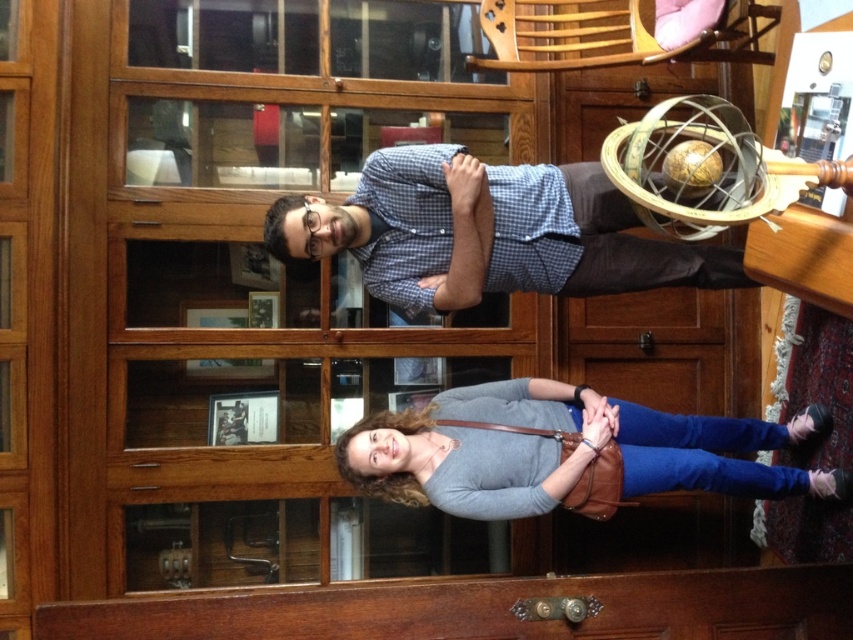
Question: Is transparent wood glass door at upper center closer to the viewer compared to matte gray sweater at lower center?

Choices:
 (A) no
 (B) yes

Answer: (A)

Question: Which of the following is the closest to the observer?

Choices:
 (A) transparent wood glass door at upper center
 (B) matte gray sweater at lower center
 (C) blue checkered shirt at center

Answer: (C)

Question: Does transparent wood glass door at upper center have a smaller size compared to blue checkered shirt at center?

Choices:
 (A) no
 (B) yes

Answer: (A)

Question: Among these objects, which one is farthest from the camera?

Choices:
 (A) transparent wood glass door at upper center
 (B) matte gray sweater at lower center
 (C) blue checkered shirt at center

Answer: (A)

Question: Which point appears farthest from the camera in this image?

Choices:
 (A) coord(682,454)
 (B) coord(492,364)
 (C) coord(567,276)

Answer: (B)

Question: Is blue checkered shirt at center below matte gray sweater at lower center?

Choices:
 (A) no
 (B) yes

Answer: (A)